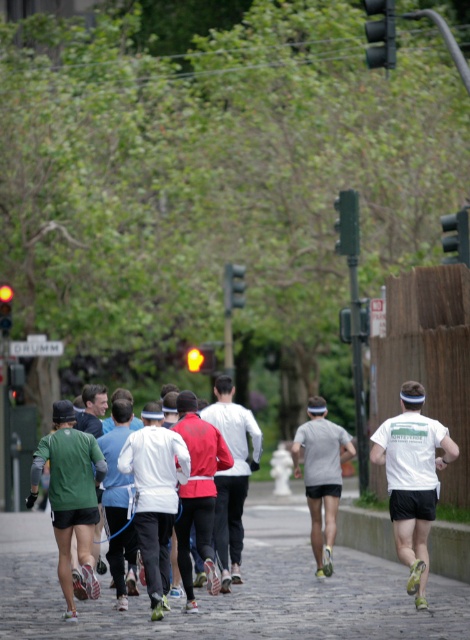
You are a photographer positioned at the starting line of the marathon. You want to capture a photo of the green matte running shirt at left and the black plastic traffic light at center in the same frame. Based on their positions, which object is closer to you?

The green matte running shirt at left is closer to you because it is positioned at the left side of the image, while the black plastic traffic light at center is further away in the scene.

You are a runner in the marathon and you want to know which traffic light is bigger. Which one is larger between the black plastic traffic light at center and the yellow glass traffic light at upper left?

The black plastic traffic light at center is larger in size than the yellow glass traffic light at upper left.

You are a runner in the marathon and you want to check if your white matte jacket at center is above the cobblestone pavement at center. Can you confirm this?

The cobblestone pavement at center is located below the white matte jacket at center, so yes, the white matte jacket at center is above the cobblestone pavement at center.